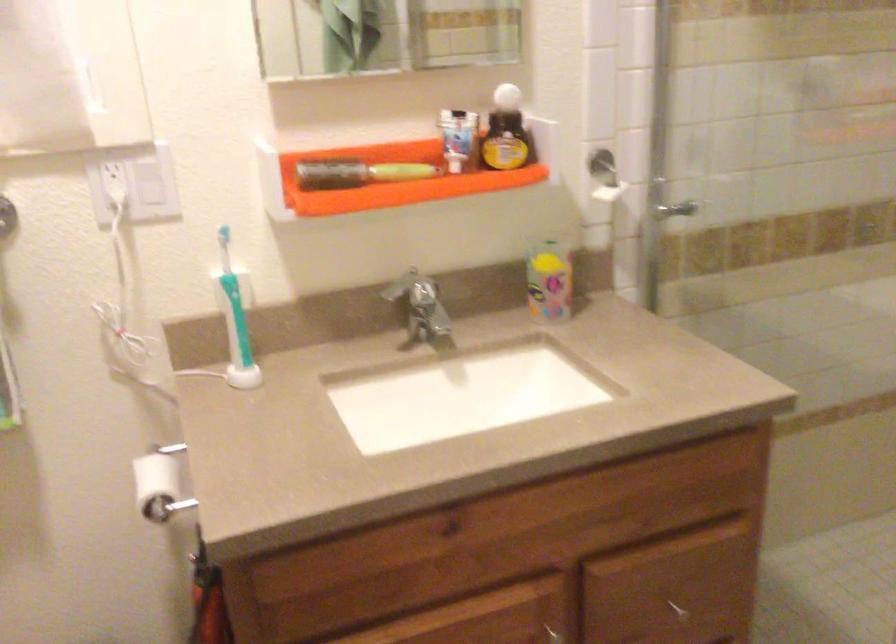
Where would you push the soap dispenser pump? Please return your answer as a coordinate pair (x, y).

(506, 131)